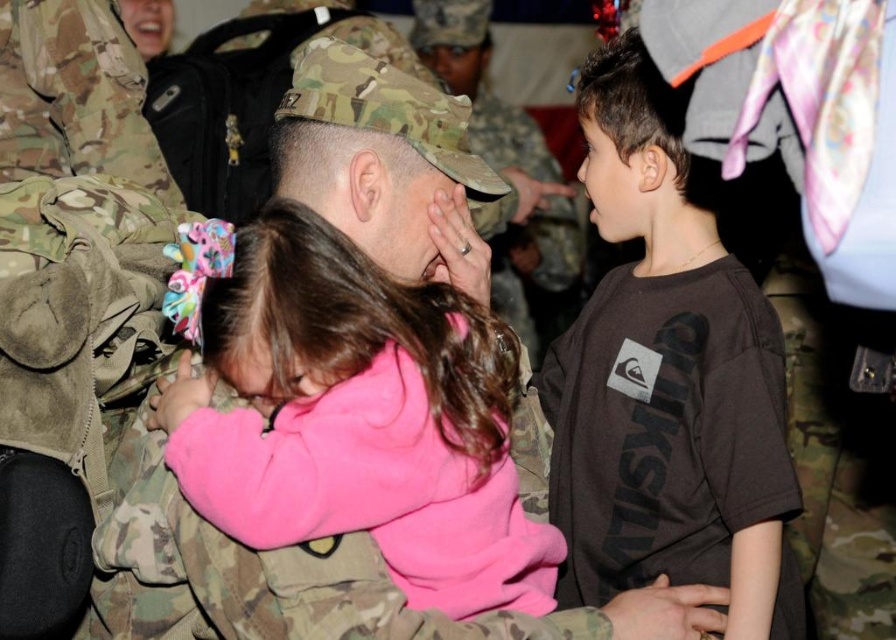
Can you confirm if pink fleece at center is wider than dark brown cotton t-shirt at right?

Indeed, pink fleece at center has a greater width compared to dark brown cotton t-shirt at right.

Is point (371, 428) less distant than point (583, 513)?

Yes, it is in front of point (583, 513).

Who is more forward, (475, 500) or (634, 310)?

Point (475, 500)

Locate an element on the screen. This screenshot has height=640, width=896. pink fleece at center is located at coordinates (359, 419).

Does dark brown cotton t-shirt at right appear on the left side of matte camouflage forehead at center?

Incorrect, dark brown cotton t-shirt at right is not on the left side of matte camouflage forehead at center.

The width and height of the screenshot is (896, 640). Identify the location of dark brown cotton t-shirt at right. [668, 380].

Is point (776, 371) closer to viewer compared to point (296, 177)?

Yes.

Where is `dark brown cotton t-shirt at right`? The height and width of the screenshot is (640, 896). dark brown cotton t-shirt at right is located at coordinates [668, 380].

Who is shorter, pink fleece at center or matte camouflage uniform at center?

pink fleece at center

Who is more distant from viewer, [341,232] or [546,262]?

The point [546,262] is behind.

Locate an element on the screen. This screenshot has width=896, height=640. pink fleece at center is located at coordinates (359, 419).